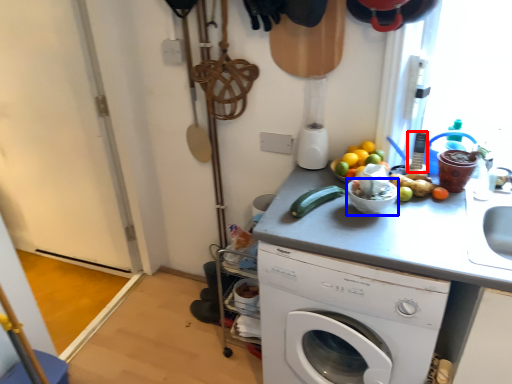
Question: Which of the following is the farthest to the observer, appliance (highlighted by a red box) or basin (highlighted by a blue box)?

Choices:
 (A) appliance
 (B) basin

Answer: (A)